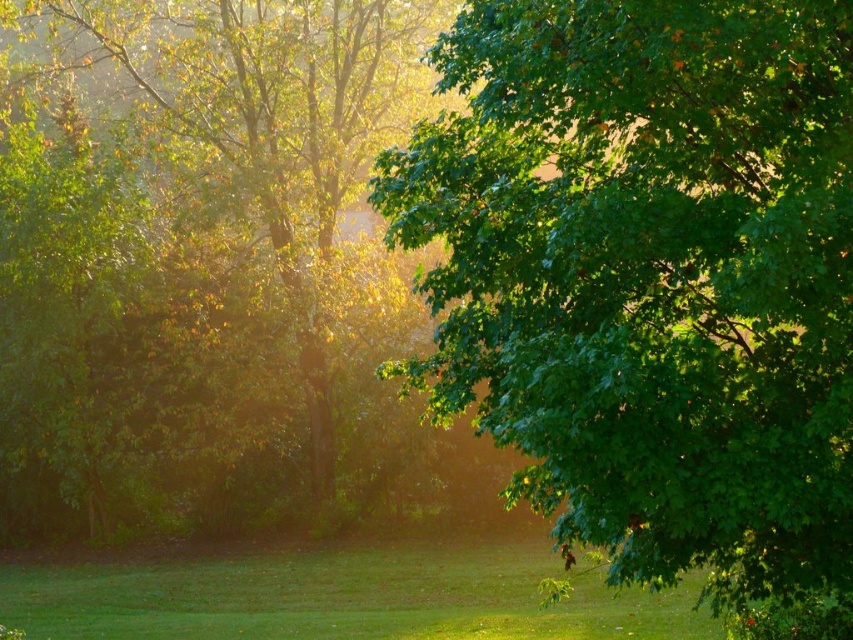
Question: Which point is farther from the camera taking this photo?

Choices:
 (A) (569, 394)
 (B) (316, 248)
 (C) (590, 589)

Answer: (B)

Question: Is green leafy tree at upper right to the left of green grass at lower center from the viewer's perspective?

Choices:
 (A) no
 (B) yes

Answer: (A)

Question: Does green leafy tree at upper right appear on the left side of green grass at lower center?

Choices:
 (A) no
 (B) yes

Answer: (A)

Question: Is green leafy tree at upper right wider than green leafy tree at left?

Choices:
 (A) no
 (B) yes

Answer: (A)

Question: Which object is positioned farthest from the green grass at lower center?

Choices:
 (A) green leafy tree at upper right
 (B) green leafy tree at left

Answer: (A)

Question: Based on their relative distances, which object is nearer to the green leafy tree at left?

Choices:
 (A) green leafy tree at upper right
 (B) green grass at lower center

Answer: (B)